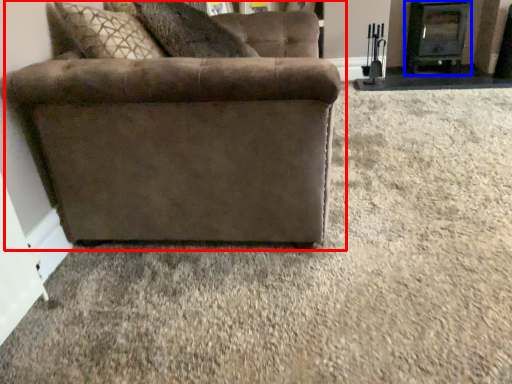
Question: Which object is closer to the camera taking this photo, studio couch (highlighted by a red box) or fireplace (highlighted by a blue box)?

Choices:
 (A) studio couch
 (B) fireplace

Answer: (A)